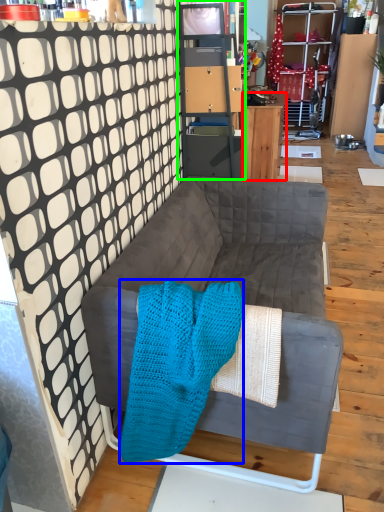
Question: Which is nearer to the desk (highlighted by a red box)? blanket (highlighted by a blue box) or cabinetry (highlighted by a green box).

Choices:
 (A) blanket
 (B) cabinetry

Answer: (B)